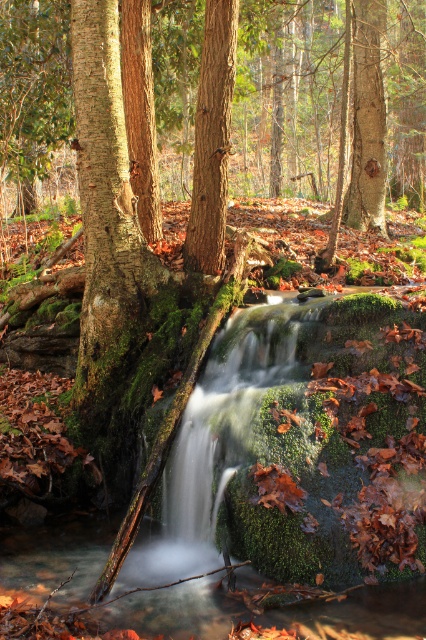
You are a hiker standing in front of the waterfall. You notice two tree trunks in the scene. Which tree trunk is closer to you, the smooth brown tree trunk at center or the rough bark tree trunk at upper center?

The smooth brown tree trunk at center is closer to the viewer than the rough bark tree trunk at upper center.

You are a nature photographer standing in the forest and want to capture both the smooth brown tree trunk at center and the rough bark tree trunk at upper center in a single frame. Which tree trunk should you adjust your camera to focus on first to ensure both are in the shot?

The smooth brown tree trunk at center is positioned on the left side of rough bark tree trunk at upper center, so you should focus on the rough bark tree trunk at upper center first as it is further away and adjust your camera to include both in the frame.